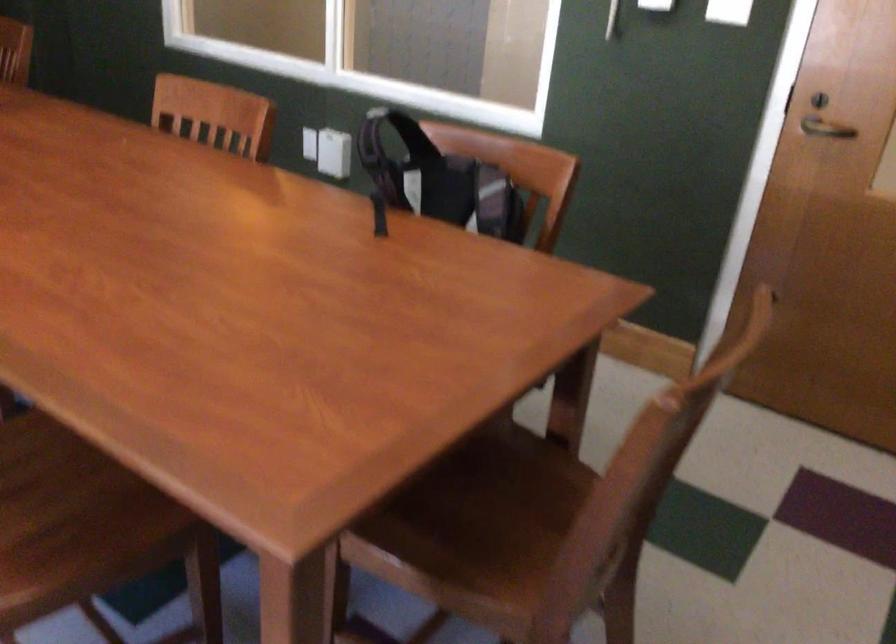
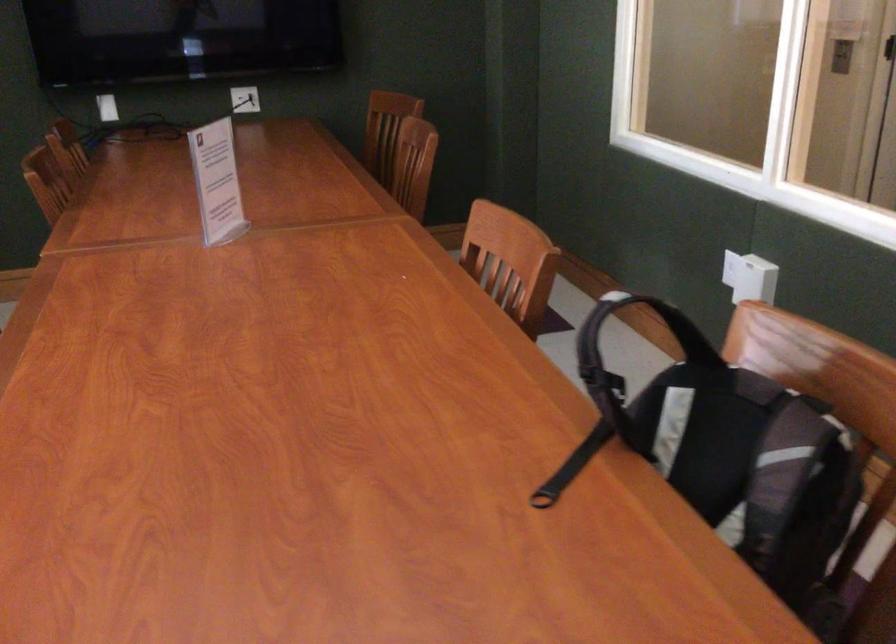
Question: How did the camera likely rotate?

Choices:
 (A) Left
 (B) Right
 (C) Up
 (D) Down

Answer: (A)